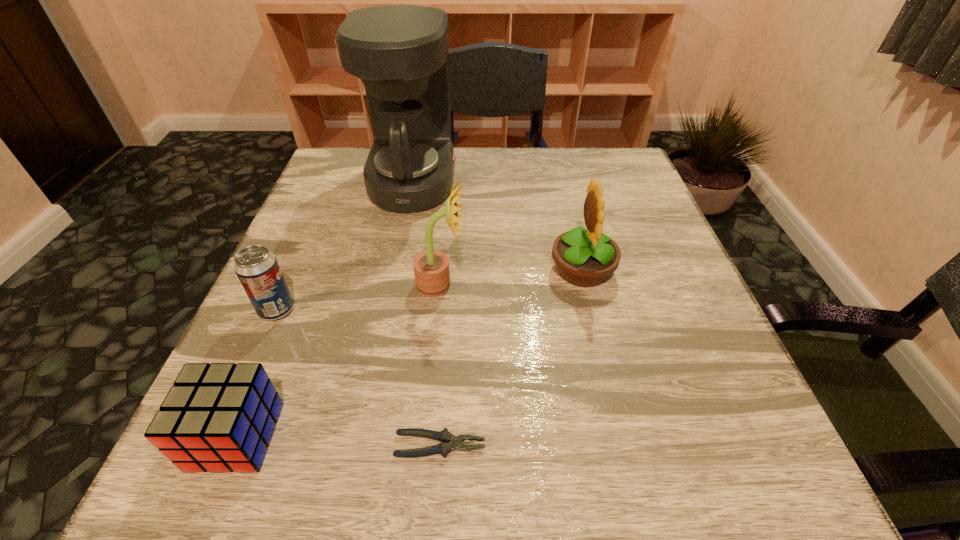
Where is `object that is the third closest to the shortest object`? object that is the third closest to the shortest object is located at coordinates pyautogui.click(x=257, y=268).

Where is `the third closest object to the right sunflower`? the third closest object to the right sunflower is located at coordinates [445, 437].

Find the location of a particular element. This screenshot has width=960, height=540. vacant space that satisfies the following two spatial constraints: 1. on the front side of the fifth tallest object; 2. on the left side of the beer can is located at coordinates (221, 436).